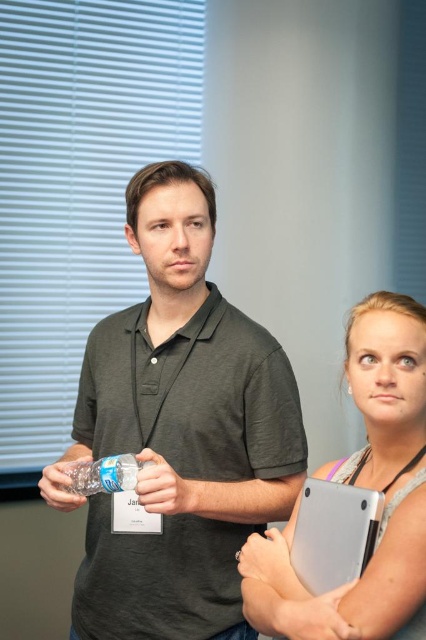
Question: Is dark green polo shirt at center above translucent plastic cup at lower left?

Choices:
 (A) no
 (B) yes

Answer: (B)

Question: Is dark green polo shirt at center in front of translucent plastic cup at lower left?

Choices:
 (A) yes
 (B) no

Answer: (A)

Question: Among these points, which one is farthest from the camera?

Choices:
 (A) (65, 492)
 (B) (250, 545)
 (C) (247, 396)
 (D) (334, 614)

Answer: (C)

Question: Is matte plastic water bottle at center smaller than translucent plastic cup at lower left?

Choices:
 (A) no
 (B) yes

Answer: (B)

Question: Which is nearer to the smooth skin hand at center?

Choices:
 (A) matte plastic water bottle at center
 (B) clear plastic bottle at center
 (C) dark green polo shirt at center
 (D) matte gray tablet at center

Answer: (D)

Question: Which object is closer to the camera taking this photo?

Choices:
 (A) dark green polo shirt at center
 (B) matte gray tablet at center
 (C) matte plastic water bottle at center

Answer: (B)